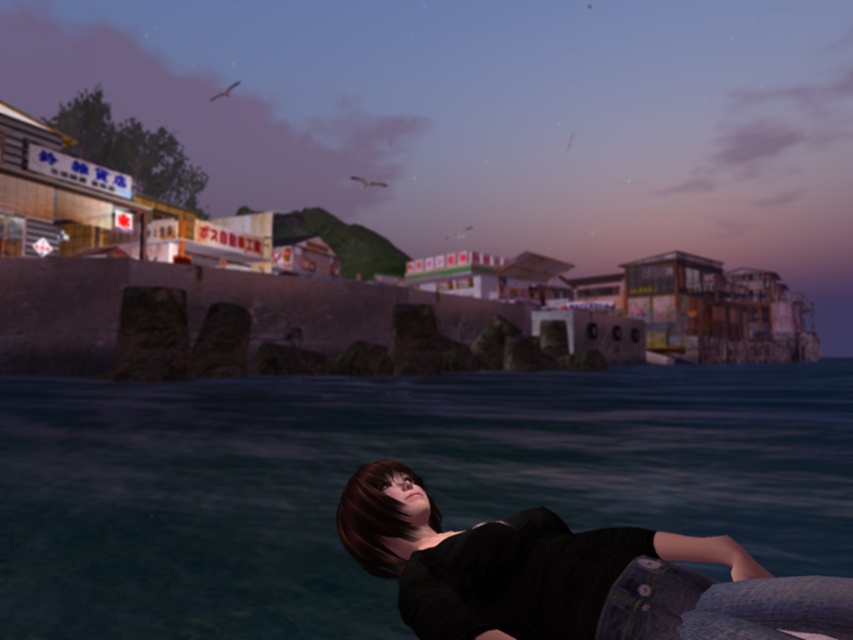
You are standing at point (496, 120) in the coastal scene. What object is located exactly at this coordinate?

The smooth concrete wall at lower center is located exactly at point (496, 120).

You are a drone operator tasked with capturing aerial footage of the smooth concrete wall at lower center and denim jeans at lower right. The minimum distance required between the drone and the objects for clear footage is 50 meters. Can the drone safely capture both objects without violating the distance requirement?

The smooth concrete wall at lower center and denim jeans at lower right are 53.74 meters apart from each other. Since the required minimum distance is 50 meters, the drone can safely capture both objects as the distance between them meets the requirement.